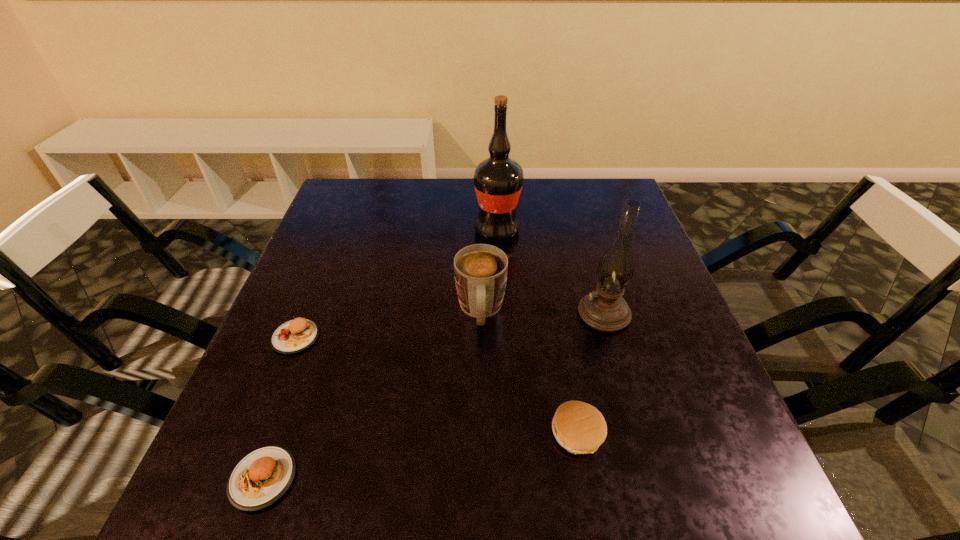
Where is `the farthest object`? The width and height of the screenshot is (960, 540). the farthest object is located at coordinates (498, 180).

Where is `wine bottle`? Image resolution: width=960 pixels, height=540 pixels. wine bottle is located at coordinates (498, 180).

This screenshot has width=960, height=540. I want to click on the fifth shortest object, so (x=615, y=270).

At what (x,y) coordinates should I click in order to perform the action: click on oil lamp. Please return your answer as a coordinate pair (x, y). The image size is (960, 540). Looking at the image, I should click on (615, 270).

You are a GUI agent. You are given a task and a screenshot of the screen. Output one action in this format:
    pyautogui.click(x=<x>, y=<y>)
    Task: Click on the fourth shortest object
    This screenshot has width=960, height=540.
    Given the screenshot: What is the action you would take?
    pyautogui.click(x=480, y=270)

This screenshot has height=540, width=960. Find the location of `the farthest food`. the farthest food is located at coordinates (293, 336).

At what (x,y) coordinates should I click in order to perform the action: click on the second object from right to left. Please return your answer as a coordinate pair (x, y). The width and height of the screenshot is (960, 540). Looking at the image, I should click on (580, 428).

What are the coordinates of `the shortest food` in the screenshot? It's located at (259, 479).

What are the coordinates of `vacant area situated 0.370m on the left of the wine bottle` in the screenshot? It's located at (340, 230).

Identify the location of vacant area situated on the front of the rightmost object. This screenshot has width=960, height=540. (616, 356).